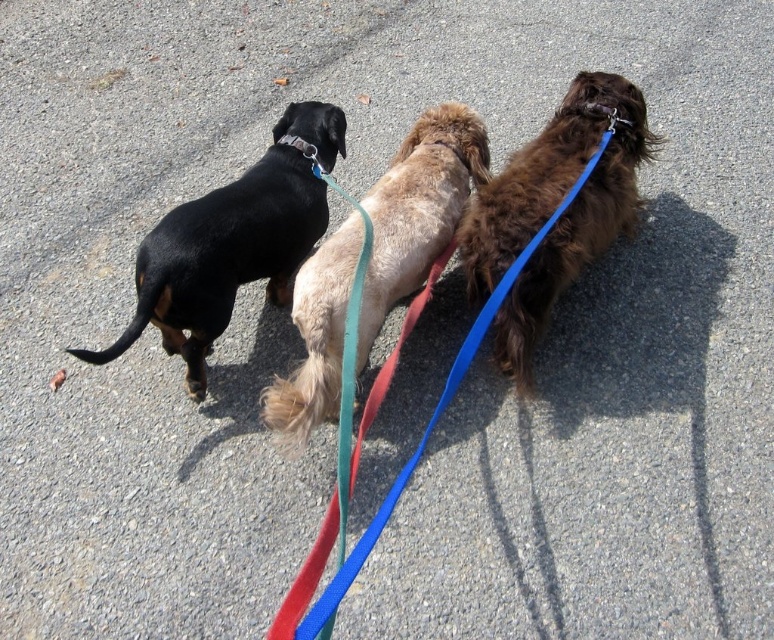
Can you confirm if brown fuzzy dog at right is positioned above metallic silver neckband at upper center?

No, brown fuzzy dog at right is not above metallic silver neckband at upper center.

Which of these two, brown fuzzy dog at right or metallic silver neckband at upper center, stands shorter?

metallic silver neckband at upper center is shorter.

You are a GUI agent. You are given a task and a screenshot of the screen. Output one action in this format:
    pyautogui.click(x=<x>, y=<y>)
    Task: Click on the brown fuzzy dog at right
    
    Given the screenshot: What is the action you would take?
    553,209

Where is `brown fuzzy dog at right`? The width and height of the screenshot is (774, 640). brown fuzzy dog at right is located at coordinates (553, 209).

Does brown fuzzy dog at right appear on the left side of fuzzy beige dog at center?

Incorrect, brown fuzzy dog at right is not on the left side of fuzzy beige dog at center.

Is point (481, 294) in front of point (344, 253)?

No.

What are the coordinates of `brown fuzzy dog at right` in the screenshot? It's located at (553, 209).

Can you confirm if black matte dog at left is positioned above fuzzy beige dog at center?

Actually, black matte dog at left is below fuzzy beige dog at center.

Does black matte dog at left appear under fuzzy beige dog at center?

Yes.

What do you see at coordinates (231, 244) in the screenshot?
I see `black matte dog at left` at bounding box center [231, 244].

You are a GUI agent. You are given a task and a screenshot of the screen. Output one action in this format:
    pyautogui.click(x=<x>, y=<y>)
    Task: Click on the black matte dog at left
    The height and width of the screenshot is (640, 774).
    Given the screenshot: What is the action you would take?
    pyautogui.click(x=231, y=244)